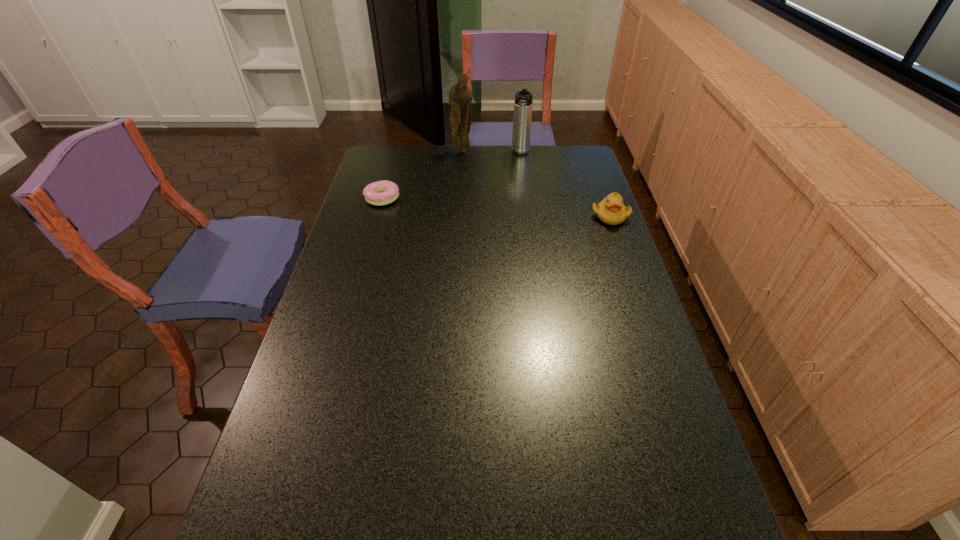
Identify the location of vacant space located 0.200m on the front-facing side of the second object from left to right. (464, 179).

Find the location of `vacant space located 0.120m on the front-facing side of the second object from left to right`. vacant space located 0.120m on the front-facing side of the second object from left to right is located at coordinates (464, 168).

The width and height of the screenshot is (960, 540). In order to click on vacant region located on the front-facing side of the second object from left to right in this screenshot , I will do `click(464, 175)`.

Find the location of a particular element. free space located on the handle side of the second tallest object is located at coordinates click(x=512, y=200).

You are a GUI agent. You are given a task and a screenshot of the screen. Output one action in this format:
    pyautogui.click(x=<x>, y=<y>)
    Task: Click on the free space located 0.370m on the handle side of the second tallest object
    
    Given the screenshot: What is the action you would take?
    pyautogui.click(x=510, y=211)

Where is `vacant space situated 0.340m on the handle side of the second tallest object`? The height and width of the screenshot is (540, 960). vacant space situated 0.340m on the handle side of the second tallest object is located at coordinates (511, 206).

Find the location of `figurine positioned at the far edge`. figurine positioned at the far edge is located at coordinates (460, 99).

Where is `thermos bottle present at the far edge`? thermos bottle present at the far edge is located at coordinates (522, 118).

At what (x,y) coordinates should I click in order to perform the action: click on object at the left edge. Please return your answer as a coordinate pair (x, y). This screenshot has height=540, width=960. Looking at the image, I should click on (384, 192).

Find the location of a particular element. The width and height of the screenshot is (960, 540). object that is positioned at the right edge is located at coordinates (611, 210).